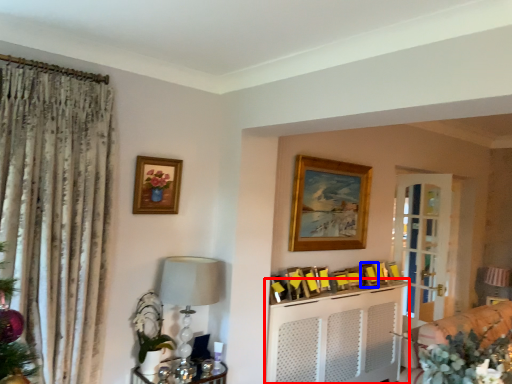
Question: Which object appears closest to the camera in this image, entertainment center (highlighted by a red box) or picture frame (highlighted by a blue box)?

Choices:
 (A) entertainment center
 (B) picture frame

Answer: (A)